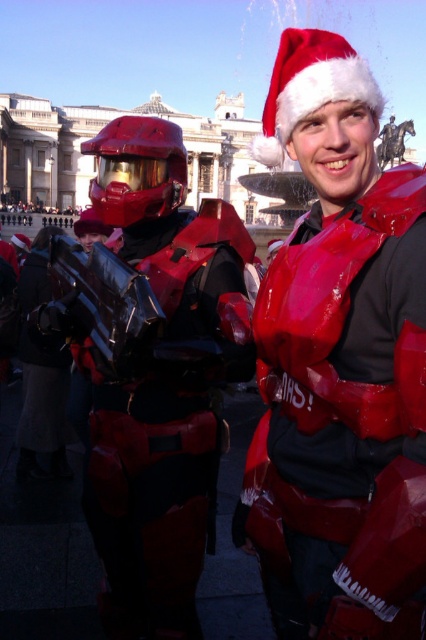
Question: Which point is farther from the camera taking this photo?

Choices:
 (A) (294, 452)
 (B) (195, 484)

Answer: (B)

Question: Can you confirm if shiny plastic santa hat at upper center is positioned to the left of glossy red armor at center?

Choices:
 (A) yes
 (B) no

Answer: (B)

Question: Does shiny plastic santa hat at upper center appear over glossy red armor at center?

Choices:
 (A) no
 (B) yes

Answer: (B)

Question: Can you confirm if shiny plastic santa hat at upper center is wider than glossy red armor at center?

Choices:
 (A) yes
 (B) no

Answer: (B)

Question: Among these objects, which one is farthest from the camera?

Choices:
 (A) shiny plastic santa hat at upper center
 (B) glossy red armor at center

Answer: (B)